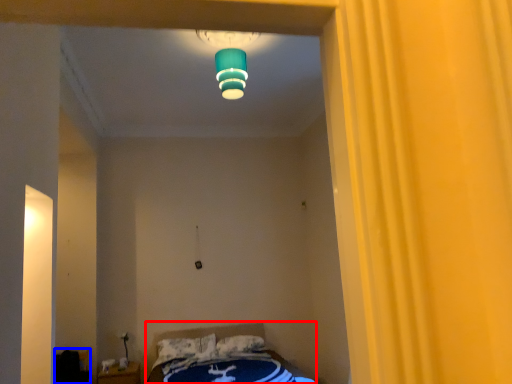
Question: Which of the following is the farthest to the observer, bed (highlighted by a red box) or furniture (highlighted by a blue box)?

Choices:
 (A) bed
 (B) furniture

Answer: (B)